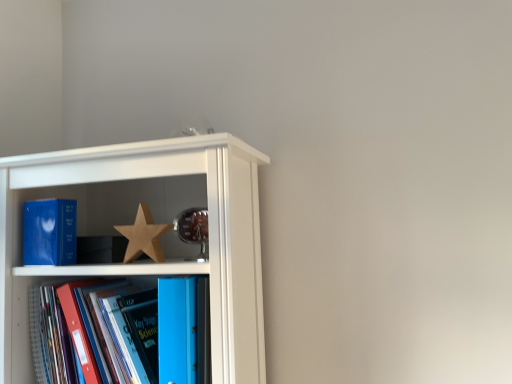
What is the approximate width of blue plastic folder at center, placed as the 3th book when sorted from left to right?

It is 6.95 inches.

What is the approximate width of matte wooden shelf at upper left?

The width of matte wooden shelf at upper left is 14.90 inches.

I want to click on wooden star at center, so click(x=143, y=236).

Image resolution: width=512 pixels, height=384 pixels. Find the location of `blue plastic folder at center, which ranks as the 1th book in right-to-left order`. blue plastic folder at center, which ranks as the 1th book in right-to-left order is located at coordinates (183, 330).

Is blue glossy folder at lower left, which is counted as the 2th book, starting from the left, behind matte wooden shelf at upper left?

Yes, blue glossy folder at lower left, which is counted as the 2th book, starting from the left, is further from the camera.

Who is smaller, blue glossy folder at lower left, marked as the second book in a right-to-left arrangement, or matte wooden shelf at upper left?

With smaller size is blue glossy folder at lower left, marked as the second book in a right-to-left arrangement.

Is blue glossy folder at lower left, marked as the second book in a right-to-left arrangement, taller than matte wooden shelf at upper left?

No.

In the scene shown: How far apart are blue glossy folder at lower left, which is counted as the 2th book, starting from the left, and matte wooden shelf at upper left?

A distance of 15.86 centimeters exists between blue glossy folder at lower left, which is counted as the 2th book, starting from the left, and matte wooden shelf at upper left.

Is blue matte book at left, arranged as the 3th book when viewed from the right, at the right side of wooden star at center?

Incorrect, blue matte book at left, arranged as the 3th book when viewed from the right, is not on the right side of wooden star at center.

How much distance is there between blue matte book at left, which ranks as the first book in left-to-right order, and wooden star at center?

blue matte book at left, which ranks as the first book in left-to-right order, is 7.29 inches away from wooden star at center.

Which object is wider, blue matte book at left, arranged as the 3th book when viewed from the right, or wooden star at center?

blue matte book at left, arranged as the 3th book when viewed from the right.

From the image's perspective, is blue matte book at left, arranged as the 3th book when viewed from the right, above wooden star at center?

No, from the image's perspective, blue matte book at left, arranged as the 3th book when viewed from the right, is not over wooden star at center.

From a real-world perspective, is matte wooden shelf at upper left physically below blue glossy folder at lower left, which is counted as the 2th book, starting from the left?

No, from a real-world perspective, matte wooden shelf at upper left is not under blue glossy folder at lower left, which is counted as the 2th book, starting from the left.

Between matte wooden shelf at upper left and blue glossy folder at lower left, which is counted as the 2th book, starting from the left, which one is positioned behind?

blue glossy folder at lower left, which is counted as the 2th book, starting from the left, is more distant.

Considering the positions of objects matte wooden shelf at upper left and blue glossy folder at lower left, marked as the second book in a right-to-left arrangement, in the image provided, who is more to the right, matte wooden shelf at upper left or blue glossy folder at lower left, marked as the second book in a right-to-left arrangement,?

From the viewer's perspective, matte wooden shelf at upper left appears more on the right side.

Between matte wooden shelf at upper left and blue plastic folder at center, placed as the 3th book when sorted from left to right, which one appears on the right side from the viewer's perspective?

blue plastic folder at center, placed as the 3th book when sorted from left to right.

Are matte wooden shelf at upper left and blue plastic folder at center, placed as the 3th book when sorted from left to right, beside each other?

They are not placed beside each other.

Can you confirm if matte wooden shelf at upper left is wider than blue plastic folder at center, placed as the 3th book when sorted from left to right?

Indeed, matte wooden shelf at upper left has a greater width compared to blue plastic folder at center, placed as the 3th book when sorted from left to right.

Considering the sizes of objects matte wooden shelf at upper left and blue plastic folder at center, placed as the 3th book when sorted from left to right, in the image provided, who is shorter, matte wooden shelf at upper left or blue plastic folder at center, placed as the 3th book when sorted from left to right,?

blue plastic folder at center, placed as the 3th book when sorted from left to right.

From the picture: Considering the relative sizes of blue glossy folder at lower left, marked as the second book in a right-to-left arrangement, and blue matte book at left, arranged as the 3th book when viewed from the right, in the image provided, is blue glossy folder at lower left, marked as the second book in a right-to-left arrangement, bigger than blue matte book at left, arranged as the 3th book when viewed from the right,?

Correct, blue glossy folder at lower left, marked as the second book in a right-to-left arrangement, is larger in size than blue matte book at left, arranged as the 3th book when viewed from the right.

Which is in front, point (188, 317) or point (55, 237)?

Point (188, 317)

Is blue glossy folder at lower left, which is counted as the 2th book, starting from the left, shorter than blue matte book at left, arranged as the 3th book when viewed from the right?

No.

From a real-world perspective, is blue glossy folder at lower left, which is counted as the 2th book, starting from the left, physically located above or below blue matte book at left, arranged as the 3th book when viewed from the right?

blue glossy folder at lower left, which is counted as the 2th book, starting from the left, is below blue matte book at left, arranged as the 3th book when viewed from the right.

Looking at this image, from the image's perspective, which one is positioned higher, blue plastic folder at center, placed as the 3th book when sorted from left to right, or blue matte book at left, which ranks as the first book in left-to-right order?

blue matte book at left, which ranks as the first book in left-to-right order, appears higher in the image.

Are blue plastic folder at center, placed as the 3th book when sorted from left to right, and blue matte book at left, which ranks as the first book in left-to-right order, beside each other?

No, blue plastic folder at center, placed as the 3th book when sorted from left to right, is not beside blue matte book at left, which ranks as the first book in left-to-right order.

Is blue plastic folder at center, which ranks as the 1th book in right-to-left order, taller than blue matte book at left, which ranks as the first book in left-to-right order?

Correct, blue plastic folder at center, which ranks as the 1th book in right-to-left order, is much taller as blue matte book at left, which ranks as the first book in left-to-right order.

Who is more distant, blue plastic folder at center, which ranks as the 1th book in right-to-left order, or blue matte book at left, arranged as the 3th book when viewed from the right?

blue matte book at left, arranged as the 3th book when viewed from the right, is further away from the camera.

Considering the relative sizes of wooden star at center and blue glossy folder at lower left, marked as the second book in a right-to-left arrangement, in the image provided, is wooden star at center shorter than blue glossy folder at lower left, marked as the second book in a right-to-left arrangement,?

Correct, wooden star at center is not as tall as blue glossy folder at lower left, marked as the second book in a right-to-left arrangement.

I want to click on the 3rd book below the wooden star at center (from the image's perspective), so click(x=121, y=332).

Is wooden star at center far away from blue glossy folder at lower left, which is counted as the 2th book, starting from the left?

No, there isn't a large distance between wooden star at center and blue glossy folder at lower left, which is counted as the 2th book, starting from the left.

Is wooden star at center closer to camera compared to blue glossy folder at lower left, marked as the second book in a right-to-left arrangement?

No, wooden star at center is further to the viewer.

Locate an element on the screen. The width and height of the screenshot is (512, 384). shelf above the blue glossy folder at lower left, which is counted as the 2th book, starting from the left (from a real-world perspective) is located at coordinates (162, 239).

The height and width of the screenshot is (384, 512). In order to click on star located above the blue matte book at left, which ranks as the first book in left-to-right order (from the image's perspective) in this screenshot , I will do `click(143, 236)`.

Looking at the image, which one is located closer to wooden star at center, blue matte book at left, which ranks as the first book in left-to-right order, or blue glossy folder at lower left, which is counted as the 2th book, starting from the left?

blue matte book at left, which ranks as the first book in left-to-right order.

Looking at the image, which one is located further to blue glossy folder at lower left, which is counted as the 2th book, starting from the left, matte wooden shelf at upper left or wooden star at center?

wooden star at center is positioned further to the anchor blue glossy folder at lower left, which is counted as the 2th book, starting from the left.

From the image, which object appears to be farther from blue plastic folder at center, which ranks as the 1th book in right-to-left order, blue matte book at left, arranged as the 3th book when viewed from the right, or wooden star at center?

The object further to blue plastic folder at center, which ranks as the 1th book in right-to-left order, is blue matte book at left, arranged as the 3th book when viewed from the right.

When comparing their distances from matte wooden shelf at upper left, does blue plastic folder at center, which ranks as the 1th book in right-to-left order, or blue matte book at left, arranged as the 3th book when viewed from the right, seem further?

Based on the image, blue matte book at left, arranged as the 3th book when viewed from the right, appears to be further to matte wooden shelf at upper left.

From the image, which object appears to be nearer to blue glossy folder at lower left, marked as the second book in a right-to-left arrangement, blue matte book at left, which ranks as the first book in left-to-right order, or matte wooden shelf at upper left?

The object closer to blue glossy folder at lower left, marked as the second book in a right-to-left arrangement, is matte wooden shelf at upper left.

When comparing their distances from matte wooden shelf at upper left, does wooden star at center or blue plastic folder at center, placed as the 3th book when sorted from left to right, seem closer?

wooden star at center is closer to matte wooden shelf at upper left.

Looking at this image, from the image, which object appears to be nearer to blue matte book at left, arranged as the 3th book when viewed from the right, blue glossy folder at lower left, which is counted as the 2th book, starting from the left, or blue plastic folder at center, placed as the 3th book when sorted from left to right?

Among the two, blue glossy folder at lower left, which is counted as the 2th book, starting from the left, is located nearer to blue matte book at left, arranged as the 3th book when viewed from the right.

Which object lies nearer to the anchor point matte wooden shelf at upper left, blue glossy folder at lower left, marked as the second book in a right-to-left arrangement, or blue matte book at left, which ranks as the first book in left-to-right order?

Among the two, blue glossy folder at lower left, marked as the second book in a right-to-left arrangement, is located nearer to matte wooden shelf at upper left.

Where is `shelf between wooden star at center and blue glossy folder at lower left, marked as the second book in a right-to-left arrangement, in the up-down direction`? shelf between wooden star at center and blue glossy folder at lower left, marked as the second book in a right-to-left arrangement, in the up-down direction is located at coordinates (162, 239).

At what (x,y) coordinates should I click in order to perform the action: click on shelf between blue matte book at left, which ranks as the first book in left-to-right order, and blue plastic folder at center, which ranks as the 1th book in right-to-left order, in the horizontal direction. Please return your answer as a coordinate pair (x, y). Looking at the image, I should click on (162, 239).

Locate an element on the screen. This screenshot has width=512, height=384. shelf between blue glossy folder at lower left, marked as the second book in a right-to-left arrangement, and blue plastic folder at center, which ranks as the 1th book in right-to-left order is located at coordinates (162, 239).

Identify the location of shelf between blue matte book at left, which ranks as the first book in left-to-right order, and blue glossy folder at lower left, which is counted as the 2th book, starting from the left, vertically. This screenshot has height=384, width=512. (162, 239).